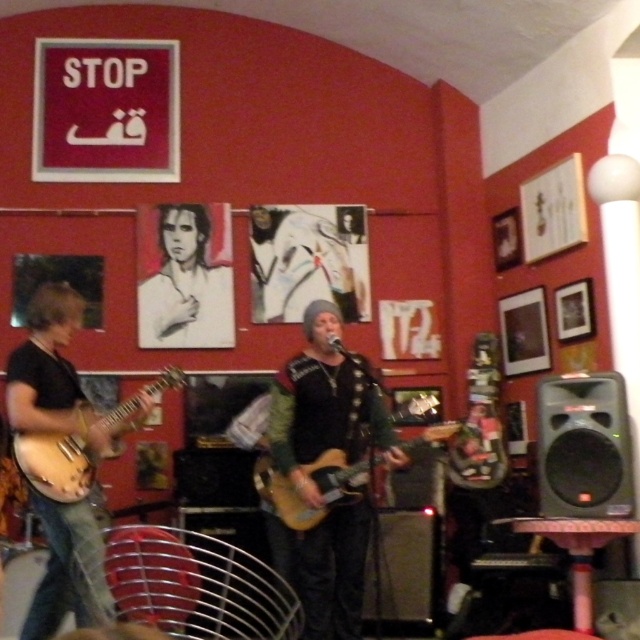
You are a photographer trying to capture the electric guitar at center. You notice a point at coordinates (326, 404) in the image. Is this point located on the electric guitar?

Yes, the point at coordinates (326, 404) is on the matte black guitar at center.

You are a photographer trying to capture a clear shot of both the matte black guitar at center and the black and white portrait at upper center during the live music performance. Which object will appear larger in your photo?

The matte black guitar at center will appear larger in your photo because it is closer to the viewer than the black and white portrait at upper center.

You are a photographer at the live music performance and want to take a picture of the black and white portrait at upper center. Where should you position yourself to capture it in the frame?

The black and white portrait at upper center is located at point 0.433 on the horizontal axis and 0.291 on the vertical axis, so you should position yourself directly in front of the portrait to capture it in the frame.